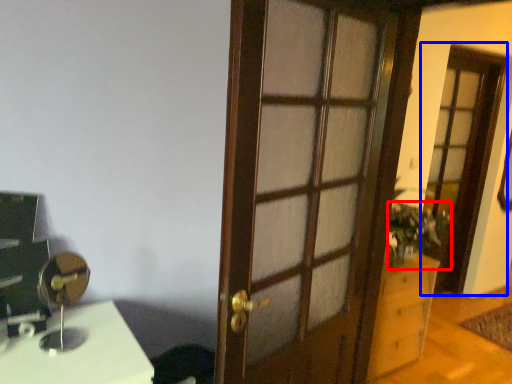
Question: Which of the following is the farthest to the observer, houseplant (highlighted by a red box) or screen door (highlighted by a blue box)?

Choices:
 (A) houseplant
 (B) screen door

Answer: (B)